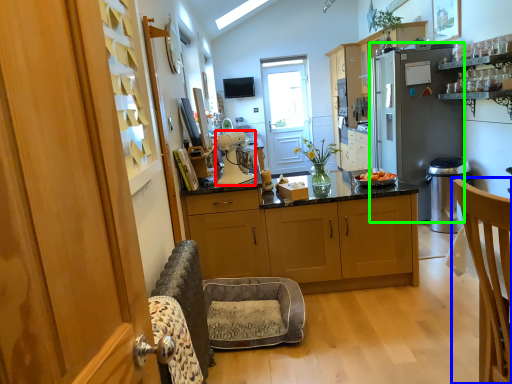
Question: Which is nearer to the kitchen appliance (highlighted by a red box)? chair (highlighted by a blue box) or refrigerator (highlighted by a green box).

Choices:
 (A) chair
 (B) refrigerator

Answer: (A)